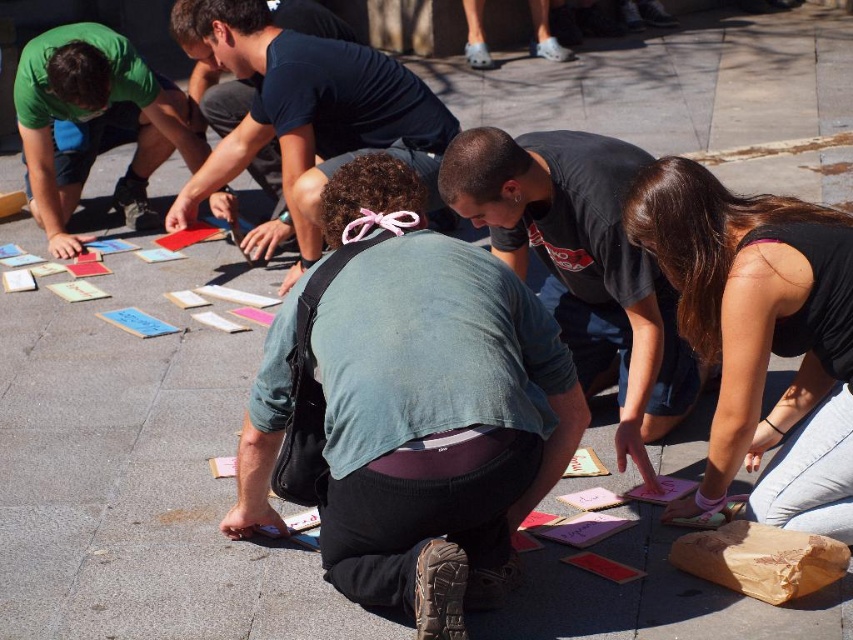
You are standing in the scene and want to pick up an object at point (352,584). Is it within your reach?

The point (352,584) is 8.54 feet away from the viewer, so it is out of reach.